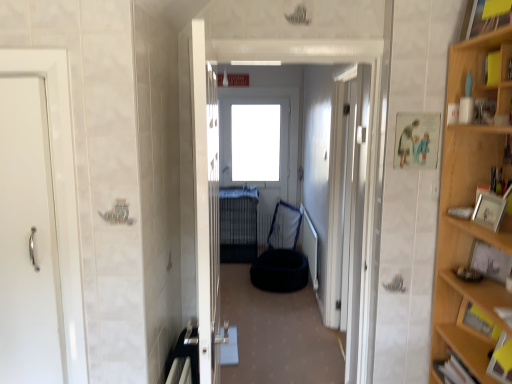
The height and width of the screenshot is (384, 512). Identify the location of vacant space that is to the left of white glossy door at center, which is the first door in right-to-left order. (281, 358).